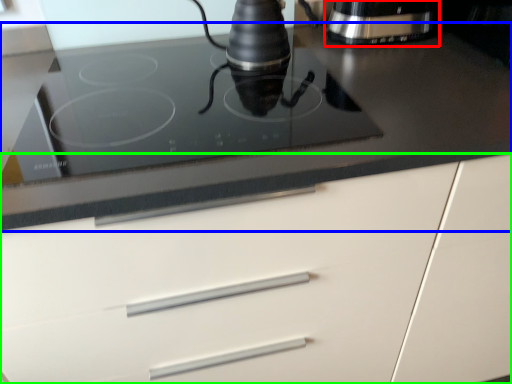
Question: Which object is positioned farthest from home appliance (highlighted by a red box)? Select from countertop (highlighted by a blue box) and cabinetry (highlighted by a green box).

Choices:
 (A) countertop
 (B) cabinetry

Answer: (B)